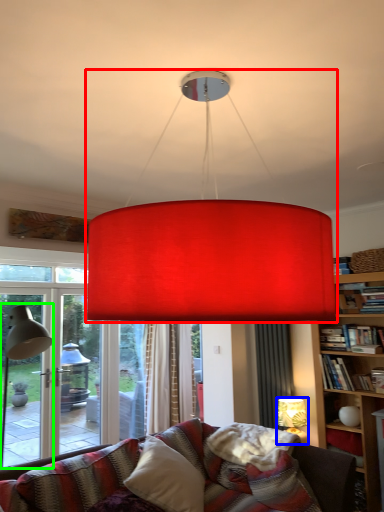
Question: Which object is positioned closest to lamp (highlighted by a red box)? Select from lamp (highlighted by a blue box) and table lamp (highlighted by a green box).

Choices:
 (A) lamp
 (B) table lamp

Answer: (B)